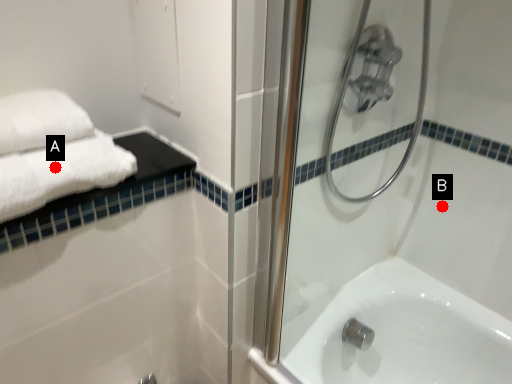
Question: Two points are circled on the image, labeled by A and B beside each circle. Which point is further to the camera?

Choices:
 (A) A is further
 (B) B is further

Answer: (B)